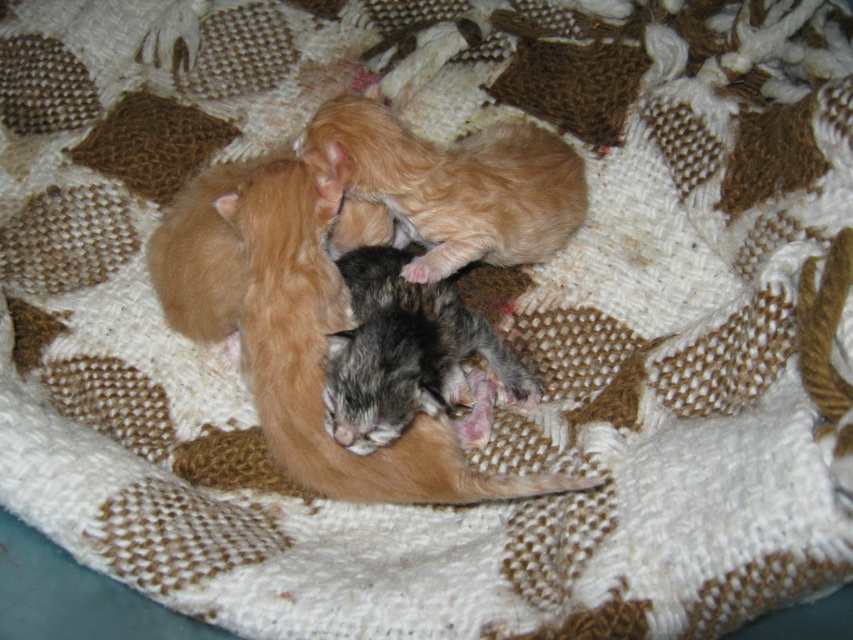
You are a photographer trying to capture a closeup of the gray fluffy kitten at center. The camera you are using has a minimum focusing distance of 36 inches. Based on the scene description, can you successfully take the photo without moving the kitten?

The kittens are 37.89 inches apart, so the distance between them is greater than the camera minimum focusing distance of 36 inches. Therefore, you can successfully take the closeup photo of the gray fluffy kitten at center without moving the kitten.